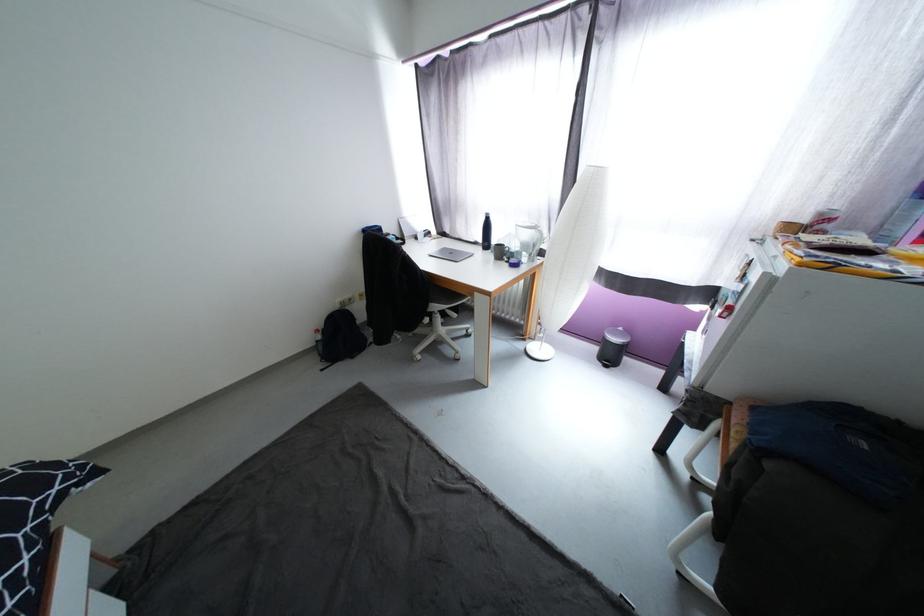
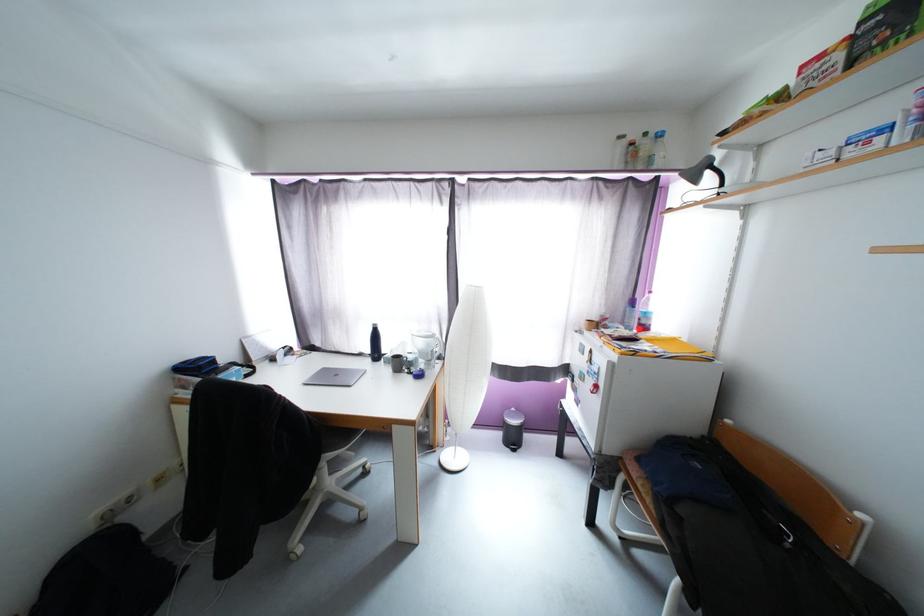
Locate, in the second image, the point that corresponds to point (774, 466) in the first image.

(687, 512)